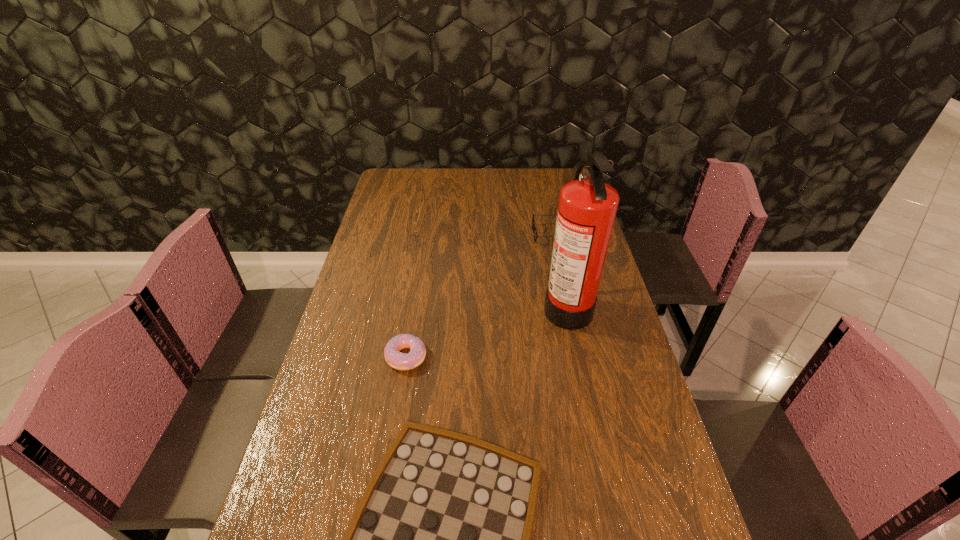
Locate an element on the screen. Image resolution: width=960 pixels, height=540 pixels. vacant space situated on the right of the doughnut is located at coordinates (470, 356).

The image size is (960, 540). Identify the location of fire extinguisher present at the right edge. (587, 206).

In order to click on spectacles that is at the right edge in this screenshot , I will do `click(533, 223)`.

You are a GUI agent. You are given a task and a screenshot of the screen. Output one action in this format:
    pyautogui.click(x=<x>, y=<y>)
    Task: Click on the blank space at the far edge
    Image resolution: width=960 pixels, height=540 pixels.
    Given the screenshot: What is the action you would take?
    click(463, 186)

The width and height of the screenshot is (960, 540). What are the coordinates of `blank area at the left edge` in the screenshot? It's located at [326, 370].

Identify the location of vacant space at the right edge. (596, 370).

In the image, there is a desktop. At what (x,y) coordinates should I click in order to perform the action: click on vacant space at the far left corner. Please return your answer as a coordinate pair (x, y). Looking at the image, I should click on (409, 194).

At what (x,y) coordinates should I click in order to perform the action: click on vacant space that is in between the spectacles and the doughnut. Please return your answer as a coordinate pair (x, y). The width and height of the screenshot is (960, 540). Looking at the image, I should click on (480, 295).

Find the location of a particular element. This screenshot has height=540, width=960. free space between the third farthest object and the tallest object is located at coordinates (487, 330).

Identify the location of free space between the doughnut and the third nearest object. (487, 330).